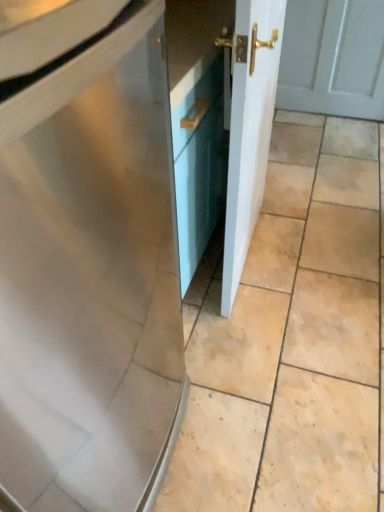
Question: Is white glossy door at center bigger than beige matte tile at center?

Choices:
 (A) no
 (B) yes

Answer: (A)

Question: Considering the relative sizes of white glossy door at center and beige matte tile at center in the image provided, is white glossy door at center wider than beige matte tile at center?

Choices:
 (A) yes
 (B) no

Answer: (B)

Question: Is white glossy door at center with beige matte tile at center?

Choices:
 (A) yes
 (B) no

Answer: (B)

Question: Considering the relative positions of white glossy door at center and beige matte tile at center in the image provided, is white glossy door at center to the left of beige matte tile at center from the viewer's perspective?

Choices:
 (A) yes
 (B) no

Answer: (B)

Question: Is white glossy door at center shorter than beige matte tile at center?

Choices:
 (A) no
 (B) yes

Answer: (A)

Question: Is white glossy door at center surrounding beige matte tile at center?

Choices:
 (A) no
 (B) yes

Answer: (A)

Question: Can you confirm if beige matte tile at center is wider than white glossy door at center?

Choices:
 (A) no
 (B) yes

Answer: (B)

Question: From the image's perspective, would you say beige matte tile at center is shown under white glossy door at center?

Choices:
 (A) no
 (B) yes

Answer: (B)

Question: Would you say beige matte tile at center is a long distance from white glossy door at center?

Choices:
 (A) yes
 (B) no

Answer: (B)

Question: Can you confirm if beige matte tile at center is thinner than white glossy door at center?

Choices:
 (A) yes
 (B) no

Answer: (B)

Question: From a real-world perspective, is beige matte tile at center located beneath white glossy door at center?

Choices:
 (A) no
 (B) yes

Answer: (B)

Question: Is beige matte tile at center positioned behind white glossy door at center?

Choices:
 (A) yes
 (B) no

Answer: (A)

Question: In terms of width, does beige matte tile at center look wider or thinner when compared to white glossy door at center?

Choices:
 (A) thin
 (B) wide

Answer: (B)